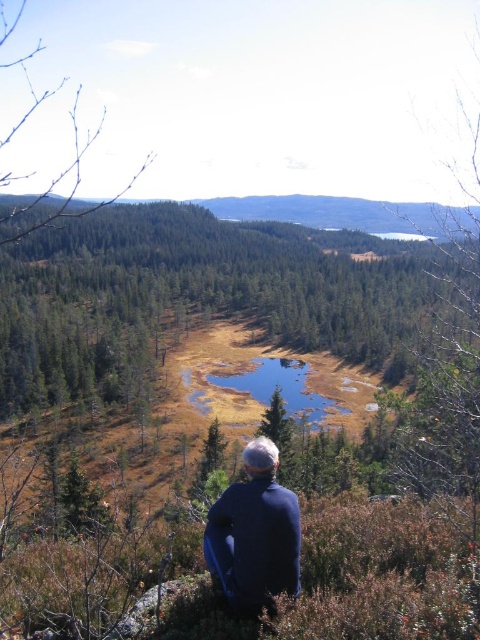
Is point (259, 497) closer to viewer compared to point (323, 417)?

Yes, it is.

Between point (230, 548) and point (251, 388), which one is positioned in front?

Point (230, 548) is more forward.

Which is in front, point (245, 500) or point (302, 404)?

Point (245, 500) is more forward.

Identify the location of blue fleece jacket at lower center. Image resolution: width=480 pixels, height=640 pixels. (254, 532).